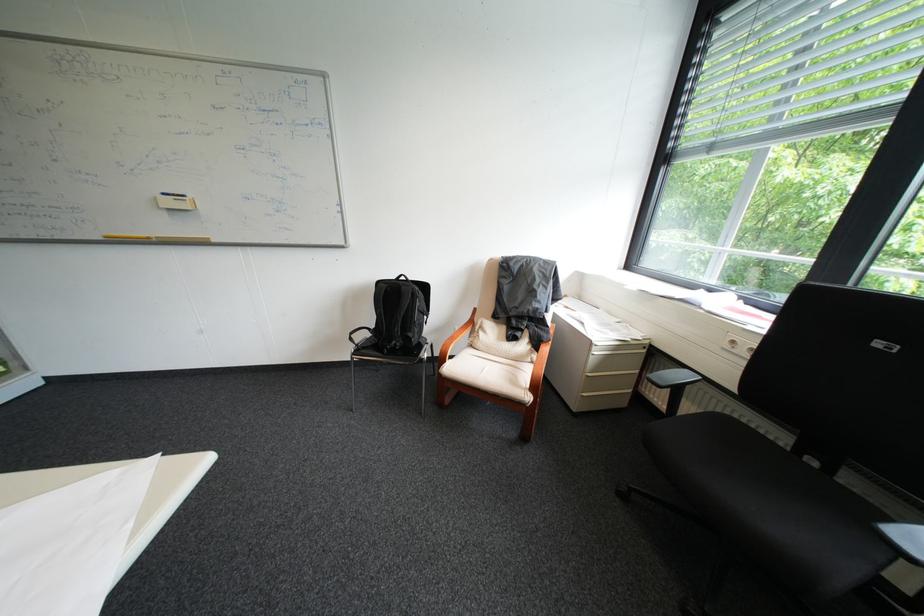
Identify the location of chair armrest. (673, 378).